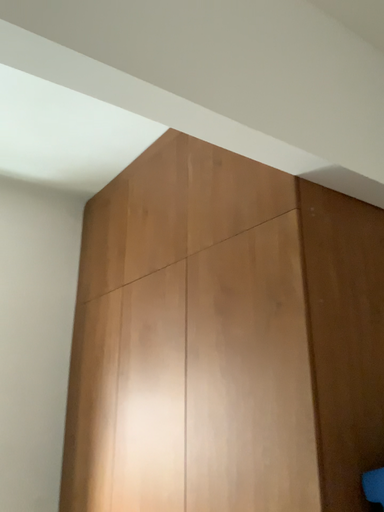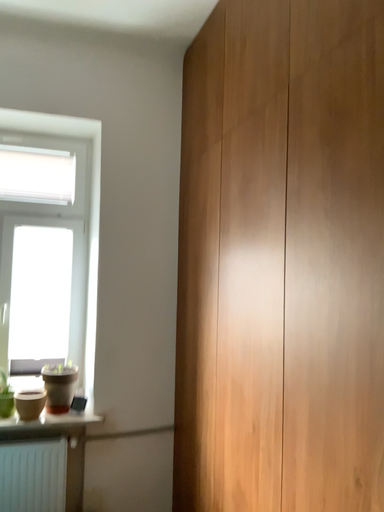
Question: How did the camera likely rotate when shooting the video?

Choices:
 (A) rotated left
 (B) rotated right

Answer: (A)